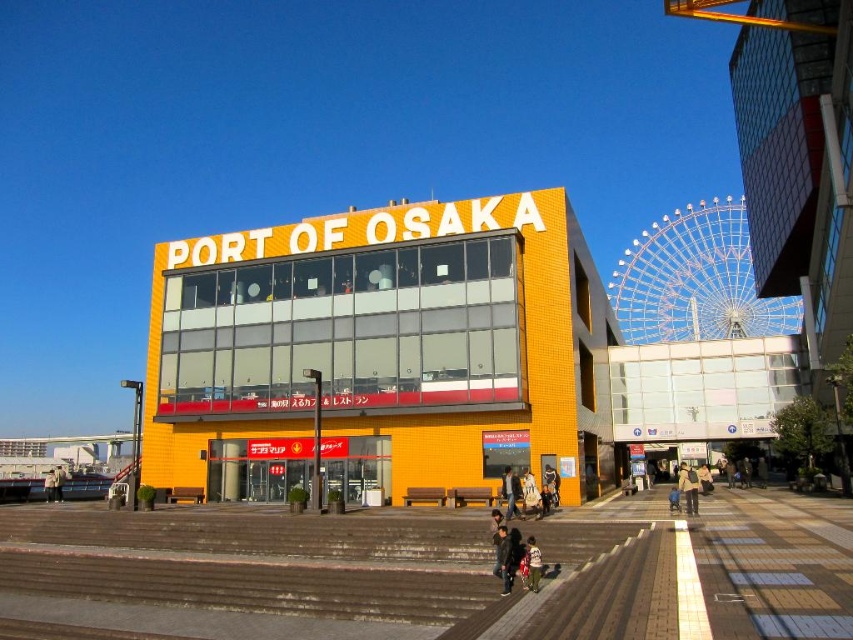
Question: Does yellow brick building at center lie in front of dark gray jacket at center?

Choices:
 (A) yes
 (B) no

Answer: (B)

Question: Estimate the real-world distances between objects in this image. Which object is closer to the yellow brick building at center?

Choices:
 (A) light brown leather jacket at center
 (B) light brown fabric pants at center
 (C) dark gray jacket at center

Answer: (A)

Question: Considering the real-world distances, which object is farthest from the light beige jacket at center?

Choices:
 (A) yellow brick building at center
 (B) light brown fabric pants at center
 (C) light brown leather jacket at center
 (D) dark gray jacket at center

Answer: (C)

Question: Which of the following is the closest to the observer?

Choices:
 (A) dark gray jacket at center
 (B) yellow brick building at center
 (C) light brown leather jacket at center

Answer: (A)

Question: Is yellow brick building at center closer to camera compared to light brown leather jacket at center?

Choices:
 (A) no
 (B) yes

Answer: (A)

Question: Can you confirm if yellow brick building at center is positioned below light brown fabric pants at center?

Choices:
 (A) yes
 (B) no

Answer: (B)